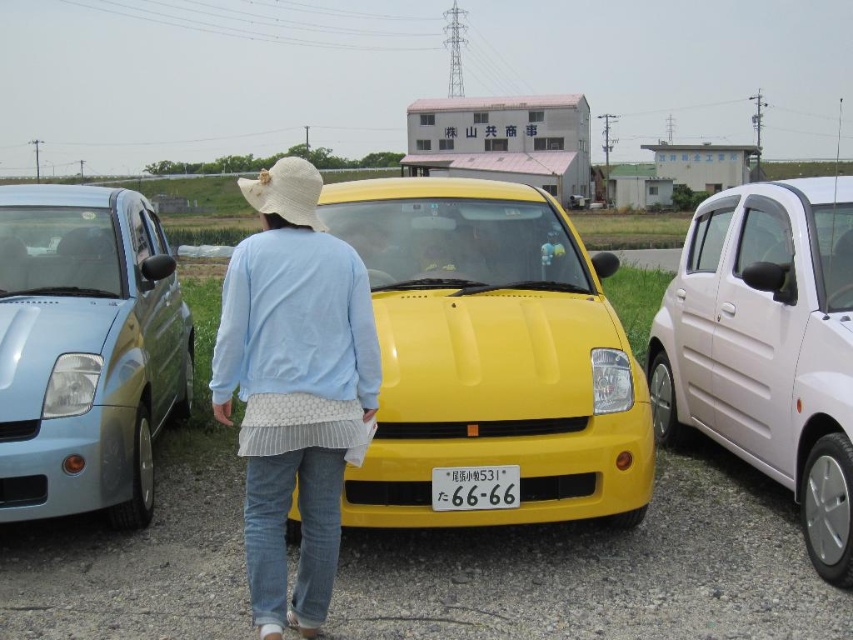
Question: Can you confirm if yellow matte car at center is positioned above light blue fabric at center?

Choices:
 (A) yes
 (B) no

Answer: (A)

Question: Which is nearer to the white matte car at right?

Choices:
 (A) white plastic license plate at center
 (B) white straw hat at center
 (C) light blue fabric at center

Answer: (A)

Question: Which object appears farthest from the camera in this image?

Choices:
 (A) matte metallic car at left
 (B) white plastic license plate at center

Answer: (A)

Question: Which object appears farthest from the camera in this image?

Choices:
 (A) white straw hat at center
 (B) light blue fabric at center

Answer: (A)

Question: Can you confirm if light blue fabric at center is smaller than white straw hat at center?

Choices:
 (A) no
 (B) yes

Answer: (B)

Question: Can you confirm if white matte car at right is bigger than white plastic license plate at center?

Choices:
 (A) no
 (B) yes

Answer: (B)